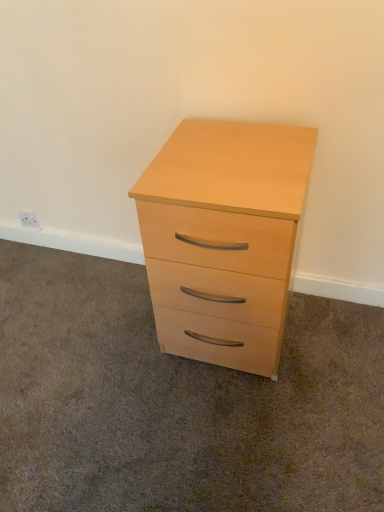
Question: From the image's perspective, is light wood drawer at center positioned above or below light wood chest of drawers at center?

Choices:
 (A) below
 (B) above

Answer: (A)

Question: Is light wood drawer at center to the left or to the right of light wood chest of drawers at center in the image?

Choices:
 (A) right
 (B) left

Answer: (B)

Question: Is light wood drawer at center situated inside light wood chest of drawers at center or outside?

Choices:
 (A) outside
 (B) inside

Answer: (A)

Question: Is light wood chest of drawers at center wider or thinner than light wood drawer at center?

Choices:
 (A) wide
 (B) thin

Answer: (B)

Question: Is point (264, 202) closer or farther from the camera than point (82, 287)?

Choices:
 (A) farther
 (B) closer

Answer: (B)

Question: From a real-world perspective, is light wood chest of drawers at center above or below light wood drawer at center?

Choices:
 (A) below
 (B) above

Answer: (B)

Question: In the image, is light wood chest of drawers at center on the left side or the right side of light wood drawer at center?

Choices:
 (A) right
 (B) left

Answer: (A)